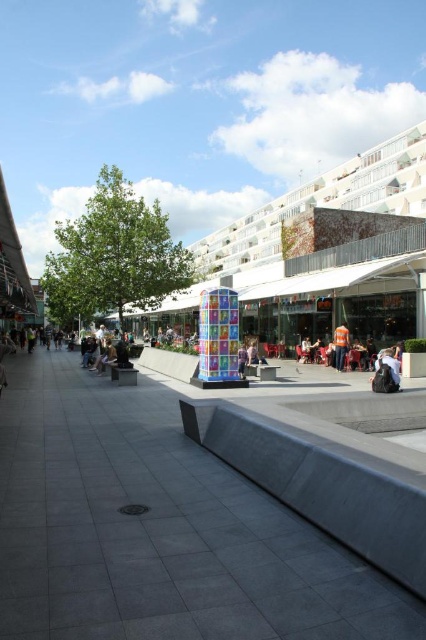
You are a street performer planning to set up your equipment in the plaza. You need to place your equipment on the gray concrete pavement at center so that it is to the right of the multicolored glass sculpture at center. Is this possible given their current positions?

The gray concrete pavement at center is positioned on the left side of multicolored glass sculpture at center, so placing the equipment on the gray concrete pavement at center to the right of the multicolored glass sculpture at center is not possible because the pavement is already to the left of the sculpture.

Based on the photo, you are standing at the plaza and want to take a photo of the point marked at coordinates (164,428). If your camera has a maximum focus range of 10 meters, will it be able to focus on that point?

The point at coordinates (164,428) is 11.43 meters away from the camera, which exceeds the maximum focus range of 10 meters. Therefore, the camera will not be able to focus on that point.